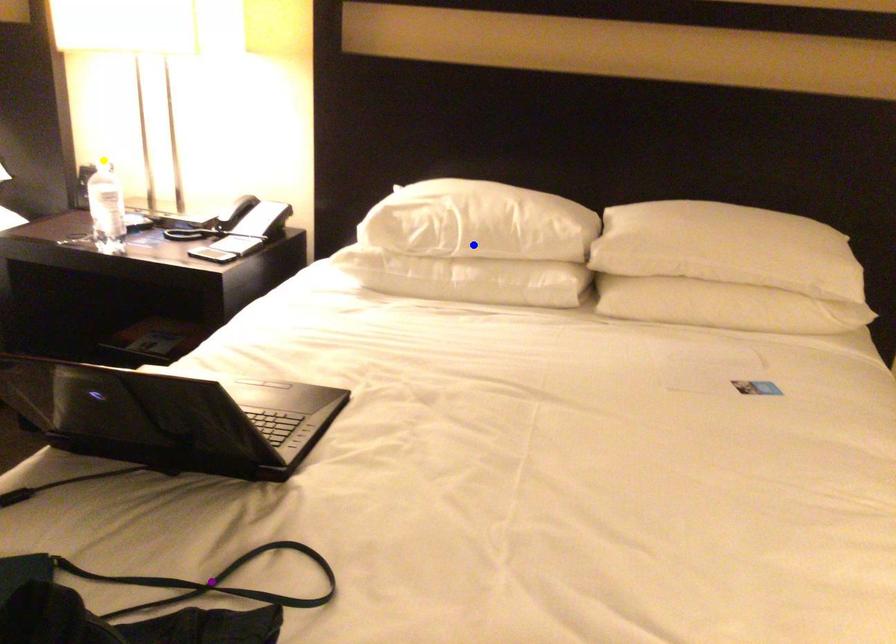
Order these from nearest to farthest:
1. yellow point
2. purple point
3. blue point

1. purple point
2. blue point
3. yellow point